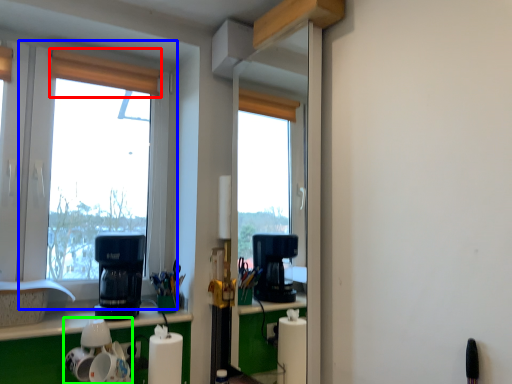
Question: Considering the real-world distances, which object is closest to curtain (highlighted by a red box)? window (highlighted by a blue box) or appliance (highlighted by a green box).

Choices:
 (A) window
 (B) appliance

Answer: (A)